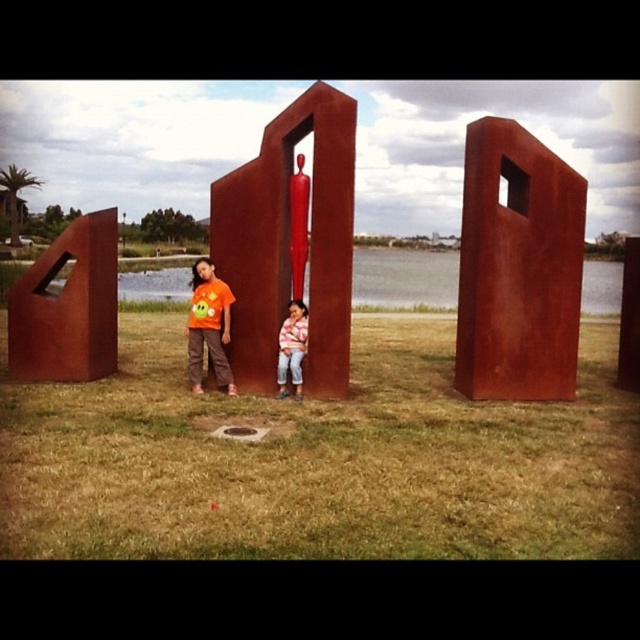
Which is above, rusty metal sculpture at center or orange matte shirt at left?

rusty metal sculpture at center is higher up.

Who is more forward, (x=316, y=296) or (x=216, y=301)?

Point (x=316, y=296) is in front.

The width and height of the screenshot is (640, 640). Find the location of `rusty metal sculpture at center`. rusty metal sculpture at center is located at coordinates (289, 243).

What do you see at coordinates (67, 307) in the screenshot? The height and width of the screenshot is (640, 640). I see `rusty metal door at left` at bounding box center [67, 307].

Does rusty metal door at left have a larger size compared to orange matte shirt at left?

Indeed, rusty metal door at left has a larger size compared to orange matte shirt at left.

Is point (76, 355) positioned in front of point (195, 352)?

That is False.

The image size is (640, 640). In order to click on rusty metal door at left in this screenshot , I will do `click(67, 307)`.

Based on the photo, between rusty metal sculpture at center and rusty metal door at left, which one has more height?

Standing taller between the two is rusty metal sculpture at center.

What do you see at coordinates (289, 243) in the screenshot? This screenshot has width=640, height=640. I see `rusty metal sculpture at center` at bounding box center [289, 243].

Image resolution: width=640 pixels, height=640 pixels. What do you see at coordinates (289, 243) in the screenshot?
I see `rusty metal sculpture at center` at bounding box center [289, 243].

Where is `rusty metal sculpture at center`? rusty metal sculpture at center is located at coordinates (289, 243).